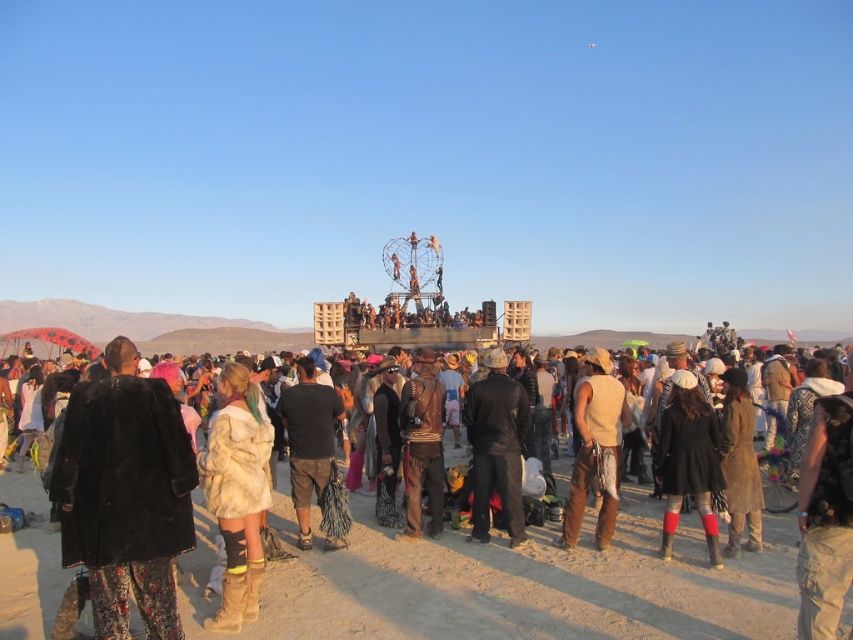
Does black leather jacket at center have a smaller size compared to black cotton shorts at center?

Incorrect, black leather jacket at center is not smaller in size than black cotton shorts at center.

Is black leather jacket at center above black cotton shorts at center?

Correct, black leather jacket at center is located above black cotton shorts at center.

Locate an element on the screen. Image resolution: width=853 pixels, height=640 pixels. black leather jacket at center is located at coordinates (496, 448).

Find the location of a particular element. The width and height of the screenshot is (853, 640). black leather jacket at center is located at coordinates (496, 448).

Between fuzzy black coat at lower left and tan leather vest at center, which one appears on the right side from the viewer's perspective?

tan leather vest at center

Can you confirm if fuzzy black coat at lower left is wider than tan leather vest at center?

Correct, the width of fuzzy black coat at lower left exceeds that of tan leather vest at center.

Does point (177, 477) come behind point (596, 422)?

No, (177, 477) is in front of (596, 422).

You are a GUI agent. You are given a task and a screenshot of the screen. Output one action in this format:
    pyautogui.click(x=<x>, y=<y>)
    Task: Click on the fuzzy black coat at lower left
    The image size is (853, 640).
    Given the screenshot: What is the action you would take?
    pyautogui.click(x=125, y=493)

Can you confirm if fuzzy black coat at lower left is smaller than black cotton shorts at center?

No, fuzzy black coat at lower left is not smaller than black cotton shorts at center.

Can you confirm if fuzzy black coat at lower left is bigger than black cotton shorts at center?

Yes, fuzzy black coat at lower left is bigger than black cotton shorts at center.

Is point (142, 605) closer to viewer compared to point (328, 460)?

Yes, point (142, 605) is closer to viewer.

Locate an element on the screen. This screenshot has height=640, width=853. fuzzy black coat at lower left is located at coordinates (125, 493).